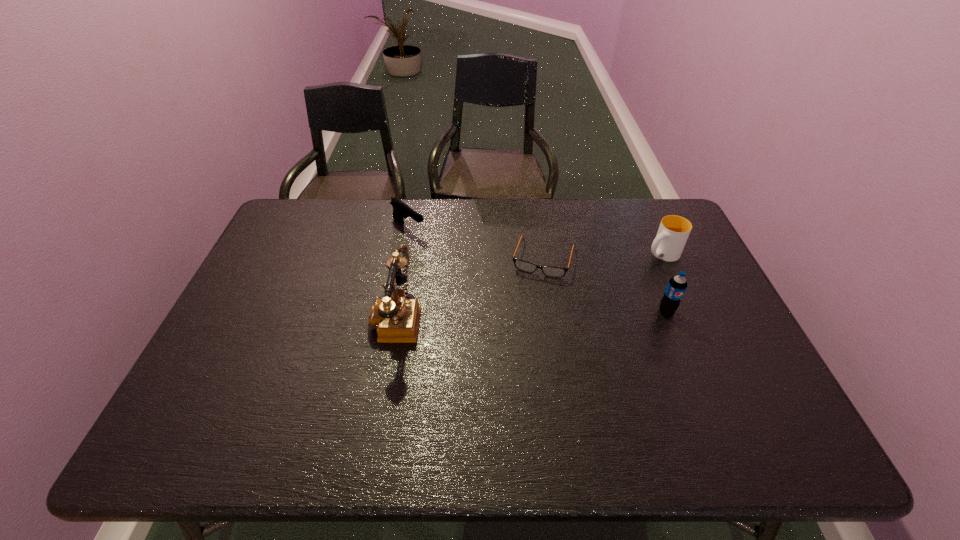
Image resolution: width=960 pixels, height=540 pixels. I want to click on vacant space situated 0.080m with the handle on the side of the third tallest object, so click(633, 271).

Identify the location of vacant space positioned 0.060m with the handle on the side of the third tallest object. This screenshot has height=540, width=960. (636, 268).

The width and height of the screenshot is (960, 540). In order to click on free spot located with the handle on the side of the third tallest object in this screenshot , I will do [579, 305].

Locate an element on the screen. vacant space situated on the front-facing side of the second shortest object is located at coordinates (500, 295).

Identify the location of free space located on the front-facing side of the second shortest object. The width and height of the screenshot is (960, 540). (498, 294).

Where is `free space located 0.310m on the front-facing side of the second shortest object`? free space located 0.310m on the front-facing side of the second shortest object is located at coordinates (486, 285).

You are a GUI agent. You are given a task and a screenshot of the screen. Output one action in this format:
    pyautogui.click(x=<x>, y=<y>)
    Task: Click on the vacant space positioned on the front-facing side of the spectacles
    The image size is (960, 540).
    Given the screenshot: What is the action you would take?
    pyautogui.click(x=526, y=315)

You are a GUI agent. You are given a task and a screenshot of the screen. Output one action in this format:
    pyautogui.click(x=<x>, y=<y>)
    Task: Click on the free region located 0.050m on the front-facing side of the spectacles
    Image resolution: width=960 pixels, height=540 pixels.
    Given the screenshot: What is the action you would take?
    pyautogui.click(x=534, y=291)

Find the location of a particular element. The height and width of the screenshot is (540, 960). vacant area situated 0.380m on the front-facing side of the spectacles is located at coordinates (506, 386).

The height and width of the screenshot is (540, 960). I want to click on pistol that is at the far edge, so click(400, 210).